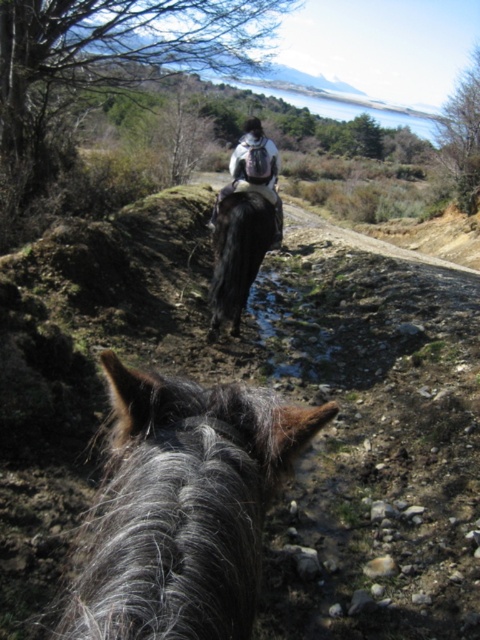
Question: Does dark brown fur at center have a lesser width compared to white matte backpack at center?

Choices:
 (A) no
 (B) yes

Answer: (B)

Question: Among these objects, which one is nearest to the camera?

Choices:
 (A) gray fuzzy horse at center
 (B) dark brown fur at center
 (C) white matte backpack at center

Answer: (A)

Question: Which object is farther from the camera taking this photo?

Choices:
 (A) dark brown fur at center
 (B) white matte backpack at center

Answer: (B)

Question: Is dark brown fur at center behind white matte backpack at center?

Choices:
 (A) yes
 (B) no

Answer: (B)

Question: Which is farther from the white matte backpack at center?

Choices:
 (A) dark brown fur at center
 (B) gray fuzzy horse at center

Answer: (B)

Question: Does dark brown fur at center come in front of white matte backpack at center?

Choices:
 (A) yes
 (B) no

Answer: (A)